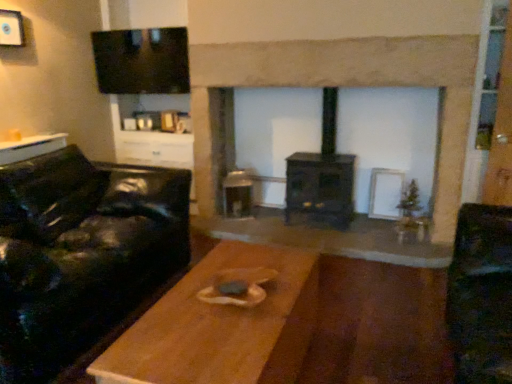
What do you see at coordinates (11, 28) in the screenshot? Image resolution: width=512 pixels, height=384 pixels. I see `white matte picture frame at upper left` at bounding box center [11, 28].

Looking at this image, measure the distance between point (28, 348) and camera.

Point (28, 348) and camera are 6.03 feet apart.

Describe the element at coordinates (221, 326) in the screenshot. The width and height of the screenshot is (512, 384). I see `wooden table at center, the 1th table when ordered from front to back` at that location.

What is the approximate width of wooden table at center, placed as the 2th table when sorted from back to front?

wooden table at center, placed as the 2th table when sorted from back to front, is 23.72 inches wide.

The width and height of the screenshot is (512, 384). Find the location of `white matte picture frame at upper left`. white matte picture frame at upper left is located at coordinates (11, 28).

Consider the image. Is wooden table at center, the 2th table viewed from the left, positioned far away from wooden table at left, which appears as the second table when ordered from the bottom?

That's right, there is a large distance between wooden table at center, the 2th table viewed from the left, and wooden table at left, which appears as the second table when ordered from the bottom.

I want to click on table on the left side of wooden table at center, which is the first table from bottom to top, so click(x=31, y=147).

Looking at their sizes, would you say wooden table at center, the 1th table when ordered from front to back, is wider or thinner than wooden table at left, which appears as the second table when ordered from the bottom?

Clearly, wooden table at center, the 1th table when ordered from front to back, has more width compared to wooden table at left, which appears as the second table when ordered from the bottom.

Relative to wooden table at left, the second table positioned from the front, is wooden table at center, the 2th table viewed from the left, in front or behind?

Clearly, wooden table at center, the 2th table viewed from the left, is in front of wooden table at left, the second table positioned from the front.

Is black matte wood burning stove at center located outside dark wood fireplace at center?

Actually, black matte wood burning stove at center is within dark wood fireplace at center.

How many degrees apart are the facing directions of black matte wood burning stove at center and dark wood fireplace at center?

The angular difference between black matte wood burning stove at center and dark wood fireplace at center is 3.86 degrees.

Are black matte wood burning stove at center and dark wood fireplace at center located far from each other?

No, black matte wood burning stove at center is not far from dark wood fireplace at center.

Considering the sizes of objects white matte picture frame at upper left and black matte wood burning stove at center in the image provided, who is thinner, white matte picture frame at upper left or black matte wood burning stove at center?

white matte picture frame at upper left.

Are white matte picture frame at upper left and black matte wood burning stove at center located far from each other?

That's right, there is a large distance between white matte picture frame at upper left and black matte wood burning stove at center.

The width and height of the screenshot is (512, 384). What are the coordinates of `wood burning stove below the white matte picture frame at upper left (from a real-world perspective)` in the screenshot? It's located at (322, 175).

Which of these two, black matte wood burning stove at center or black leather couch at left, stands taller?

With more height is black matte wood burning stove at center.

Can you confirm if black matte wood burning stove at center is positioned to the left of black leather couch at left?

No, black matte wood burning stove at center is not to the left of black leather couch at left.

Based on the photo, considering the relative sizes of black matte wood burning stove at center and black leather couch at left in the image provided, is black matte wood burning stove at center thinner than black leather couch at left?

Indeed, black matte wood burning stove at center has a lesser width compared to black leather couch at left.

Based on the photo, from a real-world perspective, who is located lower, black matte wood burning stove at center or black leather couch at left?

From a 3D spatial view, black leather couch at left is below.

Between point (21, 23) and point (8, 153), which one is positioned behind?

The point (21, 23) is behind.

Does white matte picture frame at upper left touch wooden table at left, which is the second table in right-to-left order?

No, white matte picture frame at upper left is not with wooden table at left, which is the second table in right-to-left order.

At what (x,y) coordinates should I click in order to perform the action: click on the 1st table below the white matte picture frame at upper left (from the image's perspective). Please return your answer as a coordinate pair (x, y). Looking at the image, I should click on (31, 147).

Choose the correct answer: Is white matte picture frame at upper left inside wooden table at left, the 1th table positioned from the top, or outside it?

white matte picture frame at upper left lies outside wooden table at left, the 1th table positioned from the top.

From a real-world perspective, is white matte picture frame at upper left above or below black leather couch at left?

From a real-world perspective, white matte picture frame at upper left is physically above black leather couch at left.

Is white matte picture frame at upper left wider than black leather couch at left?

No, white matte picture frame at upper left is not wider than black leather couch at left.

In the scene shown: Which is farther, (x=15, y=46) or (x=185, y=188)?

The point (x=15, y=46) is farther.

In the image, is white matte picture frame at upper left positioned in front of or behind black leather couch at left?

white matte picture frame at upper left is positioned farther from the viewer than black leather couch at left.

From a real-world perspective, is black leather couch at left under black matte wood burning stove at center?

Yes, from a real-world perspective, black leather couch at left is below black matte wood burning stove at center.

Is black matte wood burning stove at center at the back of black leather couch at left?

No, black leather couch at left is not facing the opposite direction of black matte wood burning stove at center.

Considering the sizes of black leather couch at left and black matte wood burning stove at center in the image, is black leather couch at left wider or thinner than black matte wood burning stove at center?

black leather couch at left is wider than black matte wood burning stove at center.

Image resolution: width=512 pixels, height=384 pixels. Identify the location of table on the left of wooden table at center, which is the first table from right to left. [31, 147].

This screenshot has height=384, width=512. In order to click on wood burning stove located below the dark wood fireplace at center (from the image's perspective) in this screenshot , I will do `click(322, 175)`.

When comparing their distances from wooden table at center, the 2th table viewed from the left, does black matte wood burning stove at center or white matte picture frame at upper left seem closer?

black matte wood burning stove at center is closer to wooden table at center, the 2th table viewed from the left.

Considering their positions, is wooden table at left, which is the second table in right-to-left order, positioned further to wooden table at center, which is the second table from top to bottom, than black matte wood burning stove at center?

wooden table at left, which is the second table in right-to-left order, is further to wooden table at center, which is the second table from top to bottom.

Looking at the image, which one is located closer to black matte wood burning stove at center, wooden table at left, the second table positioned from the front, or dark wood fireplace at center?

dark wood fireplace at center is closer to black matte wood burning stove at center.

Based on their spatial positions, is white matte picture frame at upper left or dark wood fireplace at center closer to black matte wood burning stove at center?

Based on the image, dark wood fireplace at center appears to be nearer to black matte wood burning stove at center.

Looking at the image, which one is located further to black leather couch at left, wooden table at left, which is the first table from back to front, or wooden table at center, which is the first table from right to left?

wooden table at center, which is the first table from right to left, is positioned further to the anchor black leather couch at left.

When comparing their distances from black matte wood burning stove at center, does dark wood fireplace at center or white matte picture frame at upper left seem further?

Based on the image, white matte picture frame at upper left appears to be further to black matte wood burning stove at center.

Considering their positions, is black leather couch at left positioned further to white matte picture frame at upper left than black matte wood burning stove at center?

black matte wood burning stove at center lies further to white matte picture frame at upper left than the other object.

In the scene shown: From the image, which object appears to be nearer to black leather couch at left, white matte picture frame at upper left or black matte wood burning stove at center?

black matte wood burning stove at center is closer to black leather couch at left.

Where is `wood burning stove between wooden table at left, which is the first table from back to front, and dark wood fireplace at center, in the horizontal direction`? The height and width of the screenshot is (384, 512). wood burning stove between wooden table at left, which is the first table from back to front, and dark wood fireplace at center, in the horizontal direction is located at coordinates (322, 175).

This screenshot has width=512, height=384. I want to click on studio couch between wooden table at left, which is the first table from back to front, and dark wood fireplace at center from left to right, so click(x=82, y=257).

The height and width of the screenshot is (384, 512). I want to click on studio couch between white matte picture frame at upper left and black matte wood burning stove at center in the horizontal direction, so click(x=82, y=257).

Locate an element on the screen. The height and width of the screenshot is (384, 512). studio couch between white matte picture frame at upper left and dark wood fireplace at center in the horizontal direction is located at coordinates (82, 257).